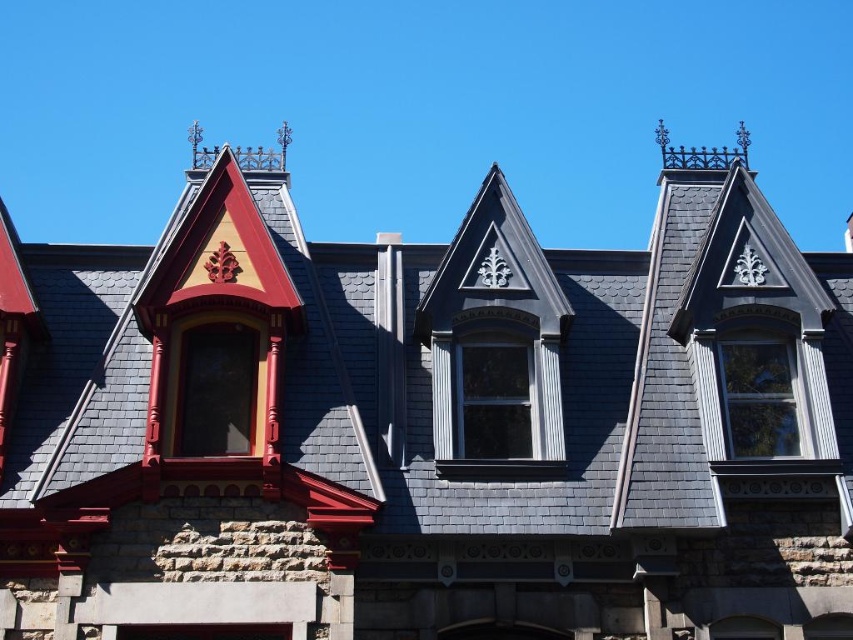
Can you confirm if matte gray wood window at center is smaller than smooth gray wood window at center right?

Actually, matte gray wood window at center might be larger than smooth gray wood window at center right.

Image resolution: width=853 pixels, height=640 pixels. I want to click on matte gray wood window at center, so click(497, 384).

Based on the photo, who is positioned more to the left, matte red wood window at upper left or clear glass window at center?

From the viewer's perspective, matte red wood window at upper left appears more on the left side.

Is point (235, 364) less distant than point (519, 364)?

Yes, it is in front of point (519, 364).

This screenshot has height=640, width=853. What do you see at coordinates (213, 387) in the screenshot?
I see `matte red wood window at upper left` at bounding box center [213, 387].

I want to click on matte red wood window at upper left, so click(x=213, y=387).

Which of these two, matte gray wood window at center or clear glass window at center, stands taller?

matte gray wood window at center is taller.

Which of these two, matte gray wood window at center or clear glass window at center, stands shorter?

clear glass window at center

Between point (447, 353) and point (471, 429), which one is positioned behind?

The point (447, 353) is behind.

The width and height of the screenshot is (853, 640). I want to click on matte gray wood window at center, so click(497, 384).